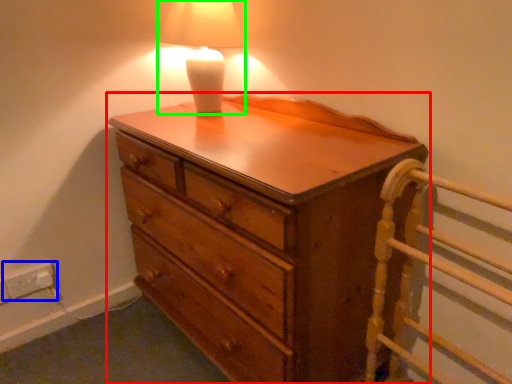
Question: Considering the real-world distances, which object is farthest from chest of drawers (highlighted by a red box)? electric outlet (highlighted by a blue box) or lamp (highlighted by a green box)?

Choices:
 (A) electric outlet
 (B) lamp

Answer: (A)